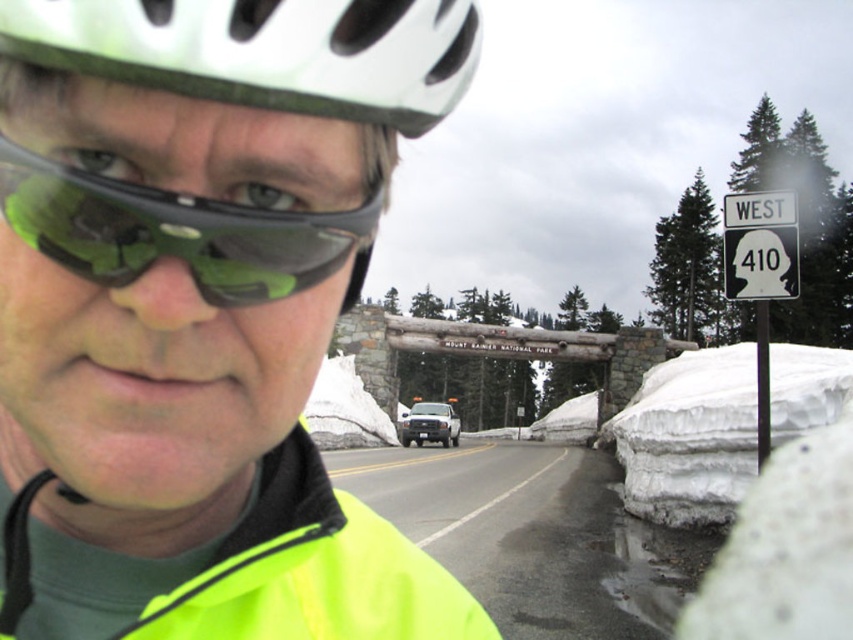
You are a hiker planning to take a photo of the Mount Rainier National Park archway. You have a camera with a zoom lens. The neon yellow jacket at center and the white matte bicycle helmet at upper center are in your shot. To ensure both are visible, should you zoom in or out?

Since the neon yellow jacket at center is to the left of the white matte bicycle helmet at upper center, you should zoom out to ensure both are visible in the frame.

You are a hiker preparing to pack your gear. You have a backpack with a compartment that can only fit items narrower than the white matte bicycle helmet at upper center. You want to bring the neon yellow jacket at center. Will it fit in the compartment?

The neon yellow jacket at center is wider than the white matte bicycle helmet at upper center, so it will not fit in the compartment designed for items narrower than the white matte bicycle helmet at upper center.

You are a hiker who needs to place a 60 feet long safety rope between the neon yellow fabric safety vest at center and the white fluffy snow at lower right. Based on the scene, will the rope be long enough to stretch between them?

The neon yellow fabric safety vest at center and the white fluffy snow at lower right are 54.76 feet apart from each other. Since the rope is 60 feet long, it will be long enough to stretch between them with some extra length remaining.